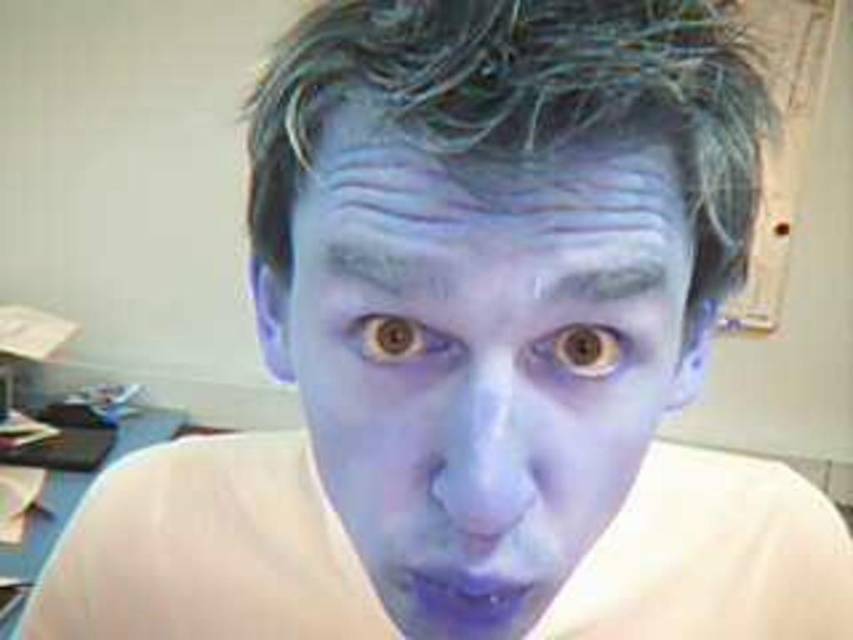
Who is more distant from viewer, (383, 198) or (700, 86)?

The point (700, 86) is more distant.

Between blue matte face at center and blue matte hair at center, which one is positioned lower?

blue matte face at center is lower down.

Does point (459, 403) come behind point (699, 20)?

No, it is in front of (699, 20).

You are a GUI agent. You are given a task and a screenshot of the screen. Output one action in this format:
    pyautogui.click(x=<x>, y=<y>)
    Task: Click on the blue matte face at center
    The width and height of the screenshot is (853, 640).
    Given the screenshot: What is the action you would take?
    pyautogui.click(x=479, y=365)

Who is taller, gray matte eyebrow at upper center or matte blue eye at center?

matte blue eye at center

Between gray matte eyebrow at upper center and matte blue eye at center, which one is positioned higher?

gray matte eyebrow at upper center

Find the location of a particular element. gray matte eyebrow at upper center is located at coordinates (599, 280).

Locate an element on the screen. This screenshot has width=853, height=640. gray matte eyebrow at upper center is located at coordinates (599, 280).

Who is more forward, (589, 140) or (593, 339)?

Point (589, 140)

Does point (264, 224) come behind point (569, 339)?

Yes, point (264, 224) is behind point (569, 339).

Identify the location of blue matte hair at center. The width and height of the screenshot is (853, 640). (526, 99).